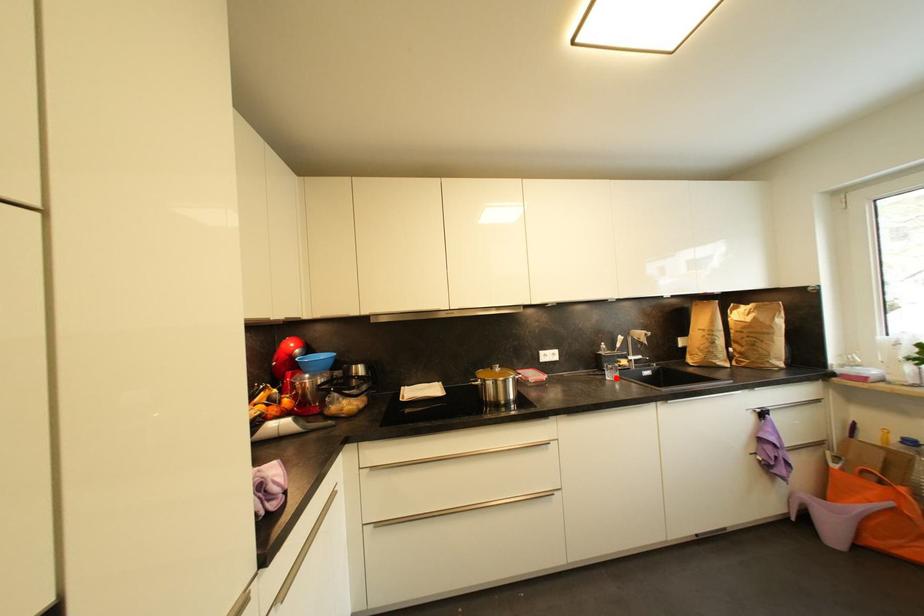
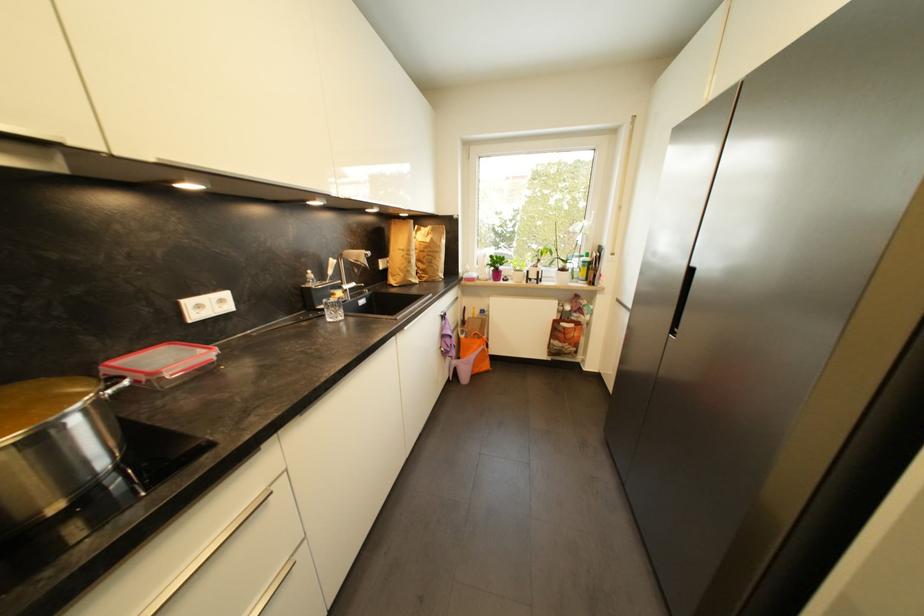
Question: I am providing you with two images of the same scene from different viewpoints. Image1 has a red point marked. In image2, the corresponding 3D location appears at what relative position? Reply with the corresponding letter.

Choices:
 (A) Closer
 (B) Farther

Answer: (A)